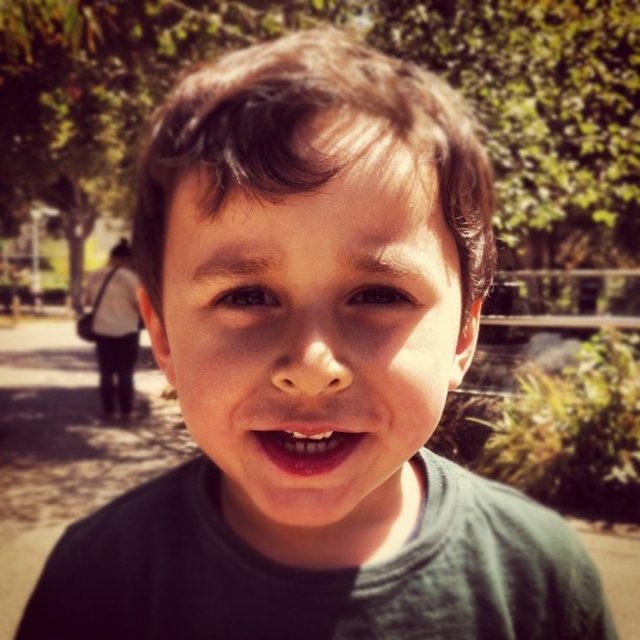
Based on the scene description, if you were to draw a vertical line dividing the image into two equal parts, would the smooth skin face at center and the pink glossy lips at center be equally divided by this line?

The smooth skin face at center is taller than the pink glossy lips at center, so they would not be equally divided by a vertical line through the center of the image.